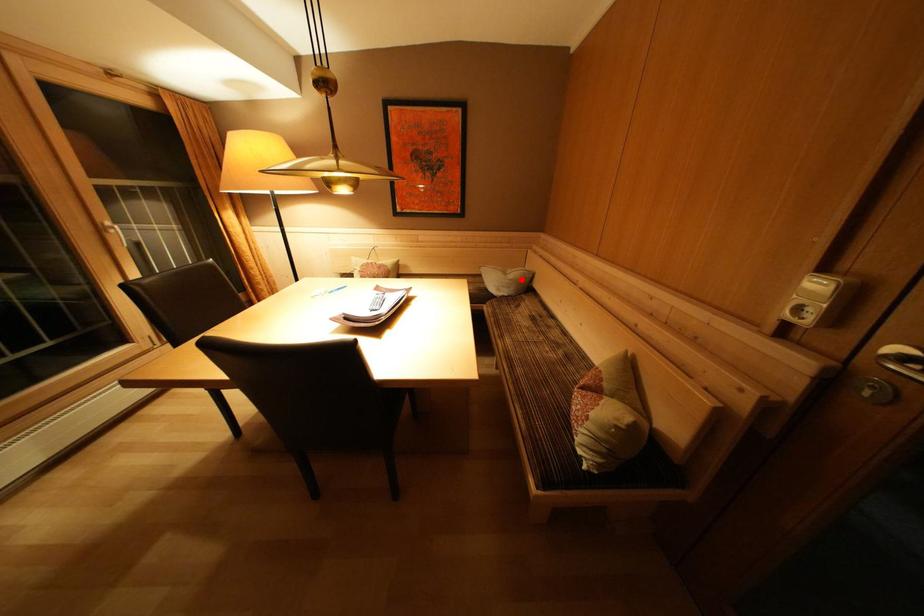
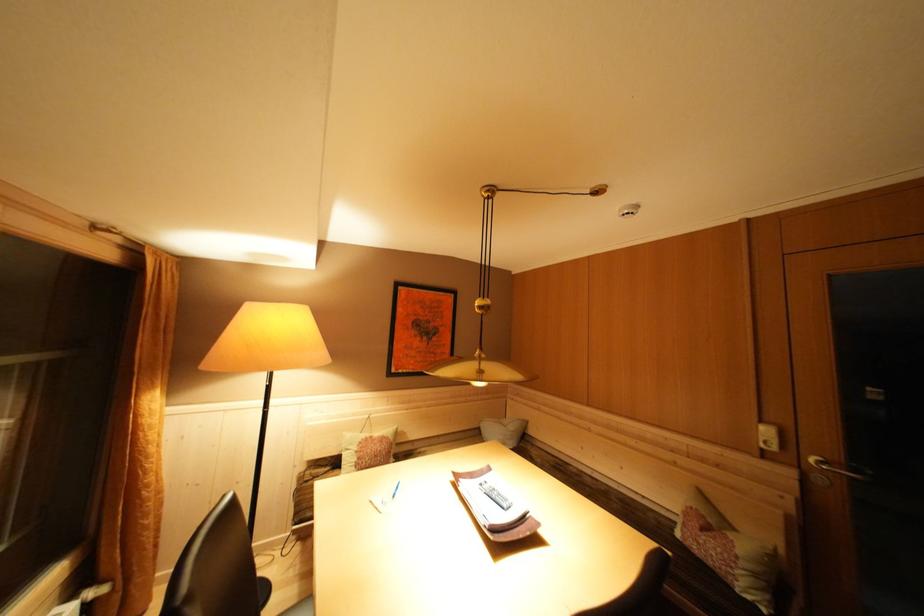
Locate, in the second image, the point that corresponds to the highlighted location in the first image.

(518, 430)